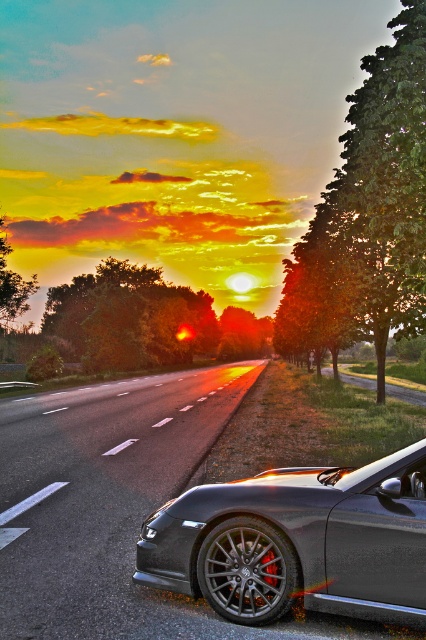
Does point (131, 493) come in front of point (396, 602)?

No, it is behind (396, 602).

What are the coordinates of `smooth asphalt highway at center` in the screenshot? It's located at (103, 499).